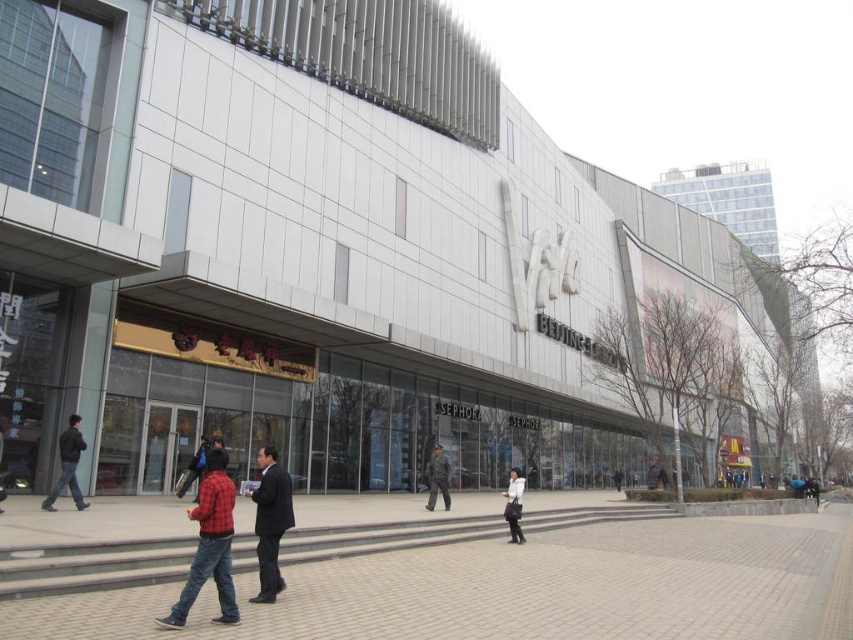
Question: Where is dark gray suit at center located in relation to dark gray jacket at left in the image?

Choices:
 (A) left
 (B) right

Answer: (B)

Question: Which object appears closest to the camera in this image?

Choices:
 (A) dark gray uniform at center
 (B) white matte jacket at center
 (C) dark gray jacket at left
 (D) gray concrete pavement at lower left

Answer: (D)

Question: Which is farther from the white matte jacket at center?

Choices:
 (A) dark gray jacket at left
 (B) gray concrete pavement at lower left
 (C) red plaid shirt at center
 (D) dark gray suit at center

Answer: (A)

Question: Which point appears closest to the camera in this image?

Choices:
 (A) (64, 477)
 (B) (616, 552)

Answer: (A)

Question: Does dark gray suit at center come behind white matte jacket at center?

Choices:
 (A) yes
 (B) no

Answer: (B)

Question: Can you confirm if red plaid shirt at center is positioned to the right of dark gray jacket at left?

Choices:
 (A) no
 (B) yes

Answer: (B)